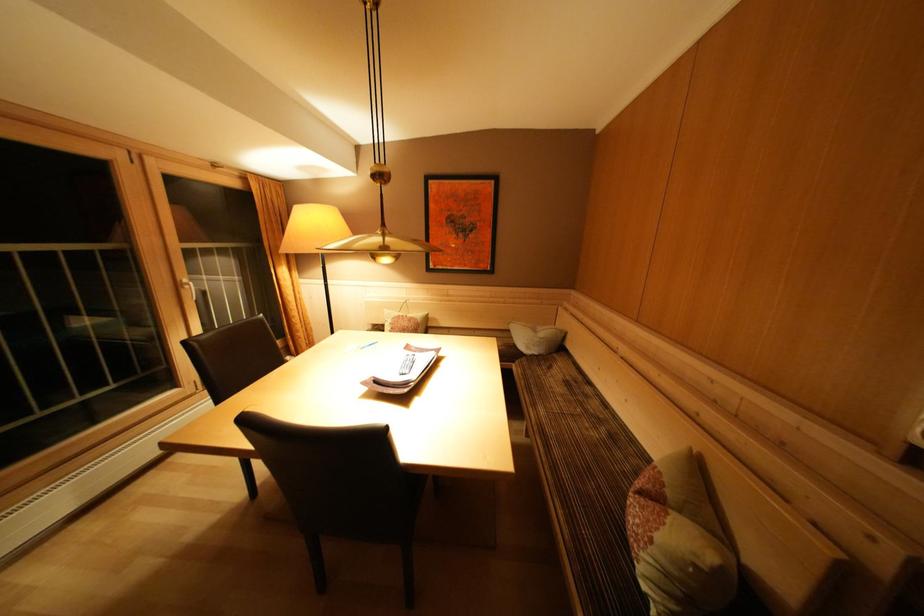
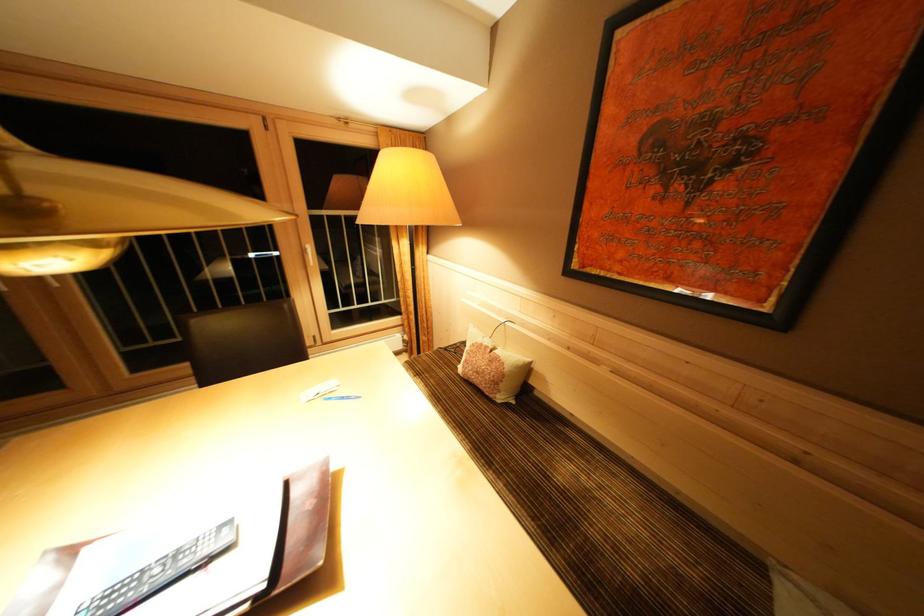
Find the pixel in the second image that matches (185,292) in the first image.

(310, 256)